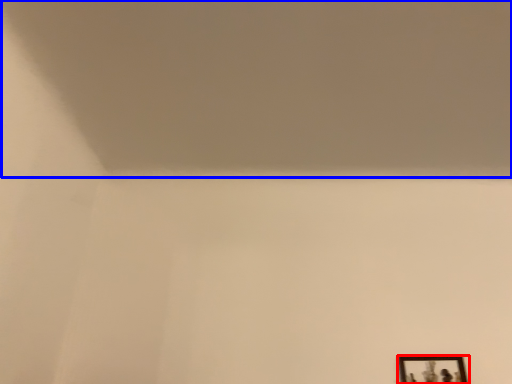
Question: Which object appears closest to the camera in this image, picture frame (highlighted by a red box) or wide (highlighted by a blue box)?

Choices:
 (A) picture frame
 (B) wide

Answer: (B)